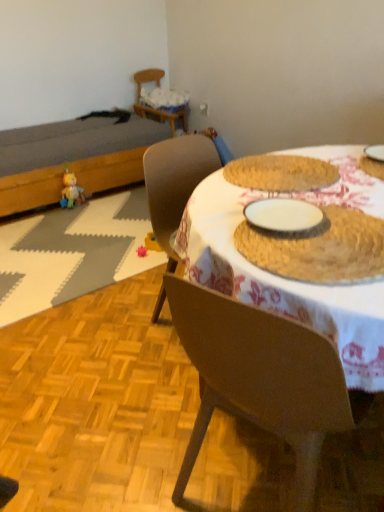
Question: Considering the relative positions of brown woven placemat at center and brown wood table at center in the image provided, is brown woven placemat at center to the left of brown wood table at center from the viewer's perspective?

Choices:
 (A) yes
 (B) no

Answer: (A)

Question: Could brown wood table at center be considered to be inside brown woven placemat at center?

Choices:
 (A) yes
 (B) no

Answer: (B)

Question: Does brown woven placemat at center have a larger size compared to brown wood table at center?

Choices:
 (A) yes
 (B) no

Answer: (B)

Question: From the image's perspective, is brown woven placemat at center above brown wood table at center?

Choices:
 (A) no
 (B) yes

Answer: (A)

Question: Is brown woven placemat at center outside of brown wood table at center?

Choices:
 (A) no
 (B) yes

Answer: (A)

Question: Is brown wood table at center in front of or behind wooden chair at upper left, the first chair from the back, in the image?

Choices:
 (A) front
 (B) behind

Answer: (A)

Question: Choose the correct answer: Is brown wood table at center inside wooden chair at upper left, which appears as the first chair when viewed from the left, or outside it?

Choices:
 (A) inside
 (B) outside

Answer: (B)

Question: From a real-world perspective, is brown wood table at center above or below wooden chair at upper left, which is counted as the 1th chair, starting from the top?

Choices:
 (A) below
 (B) above

Answer: (B)

Question: Considering the positions of brown wood table at center and wooden chair at upper left, the first chair from the back, in the image, is brown wood table at center bigger or smaller than wooden chair at upper left, the first chair from the back,?

Choices:
 (A) small
 (B) big

Answer: (B)

Question: Is plush yellow duck at left, which is the second toy in right-to-left order, wider or thinner than brown wood table at center?

Choices:
 (A) thin
 (B) wide

Answer: (A)

Question: From the image's perspective, relative to brown wood table at center, is plush yellow duck at left, positioned as the 1th toy in top-to-bottom order, above or below?

Choices:
 (A) below
 (B) above

Answer: (B)

Question: Would you say plush yellow duck at left, which is counted as the first toy, starting from the left, is inside or outside brown wood table at center?

Choices:
 (A) inside
 (B) outside

Answer: (B)

Question: Considering the positions of plush yellow duck at left, the 2th toy when ordered from bottom to top, and brown wood table at center in the image, is plush yellow duck at left, the 2th toy when ordered from bottom to top, bigger or smaller than brown wood table at center?

Choices:
 (A) big
 (B) small

Answer: (B)

Question: Would you say wooden chair at upper left, which is the 2th chair from bottom to top, is to the left or to the right of brown matte chair at center, which is the first chair from bottom to top, in the picture?

Choices:
 (A) left
 (B) right

Answer: (A)

Question: From a real-world perspective, is wooden chair at upper left, which is the 2th chair from bottom to top, above or below brown matte chair at center, which is counted as the 2th chair, starting from the top?

Choices:
 (A) below
 (B) above

Answer: (B)